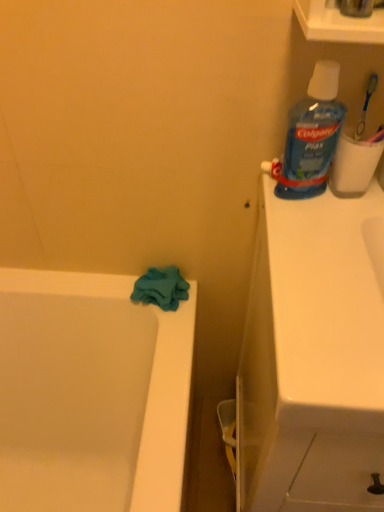
Question: Is white matte toilet paper at upper right turned away from blue translucent plastic mouthwash at upper right?

Choices:
 (A) yes
 (B) no

Answer: (B)

Question: Considering the relative sizes of white matte toilet paper at upper right and blue translucent plastic mouthwash at upper right in the image provided, is white matte toilet paper at upper right wider than blue translucent plastic mouthwash at upper right?

Choices:
 (A) yes
 (B) no

Answer: (B)

Question: Is white matte toilet paper at upper right placed right next to blue translucent plastic mouthwash at upper right?

Choices:
 (A) no
 (B) yes

Answer: (B)

Question: Is the depth of white matte toilet paper at upper right less than that of blue translucent plastic mouthwash at upper right?

Choices:
 (A) yes
 (B) no

Answer: (B)

Question: Considering the relative sizes of white matte toilet paper at upper right and blue translucent plastic mouthwash at upper right in the image provided, is white matte toilet paper at upper right taller than blue translucent plastic mouthwash at upper right?

Choices:
 (A) no
 (B) yes

Answer: (A)

Question: Is white matte toilet paper at upper right surrounding blue translucent plastic mouthwash at upper right?

Choices:
 (A) yes
 (B) no

Answer: (B)

Question: Is white glossy sink at upper right shorter than white matte toilet paper at upper right?

Choices:
 (A) no
 (B) yes

Answer: (A)

Question: From a real-world perspective, is white glossy sink at upper right under white matte toilet paper at upper right?

Choices:
 (A) yes
 (B) no

Answer: (A)

Question: From a real-world perspective, is white glossy sink at upper right on white matte toilet paper at upper right?

Choices:
 (A) yes
 (B) no

Answer: (B)

Question: From the image's perspective, is white glossy sink at upper right under white matte toilet paper at upper right?

Choices:
 (A) no
 (B) yes

Answer: (B)

Question: Is there a large distance between white glossy sink at upper right and white matte toilet paper at upper right?

Choices:
 (A) no
 (B) yes

Answer: (A)

Question: From the image's perspective, is white glossy sink at upper right above white matte toilet paper at upper right?

Choices:
 (A) yes
 (B) no

Answer: (B)

Question: From a real-world perspective, is white glossy sink at upper right located beneath blue plastic toothbrush at upper right?

Choices:
 (A) no
 (B) yes

Answer: (B)